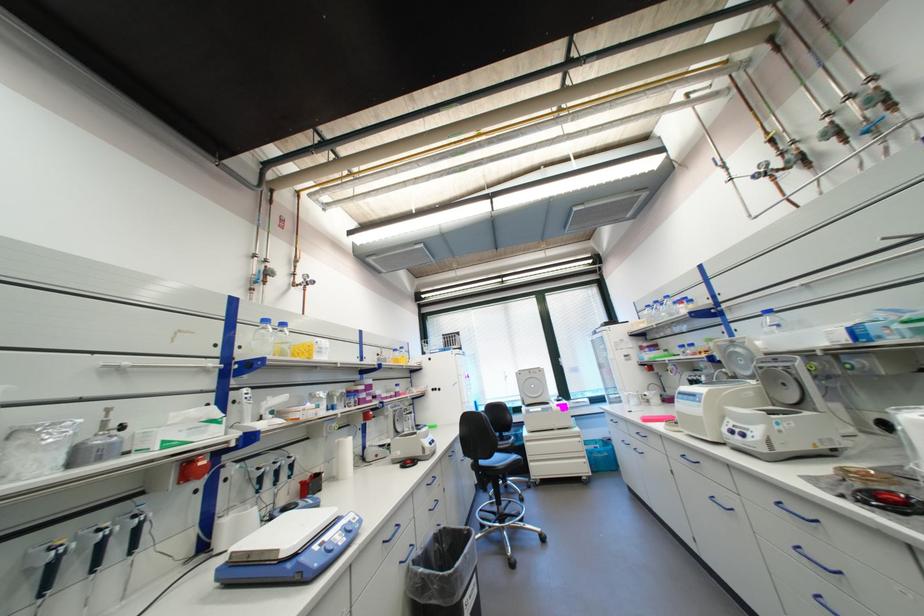
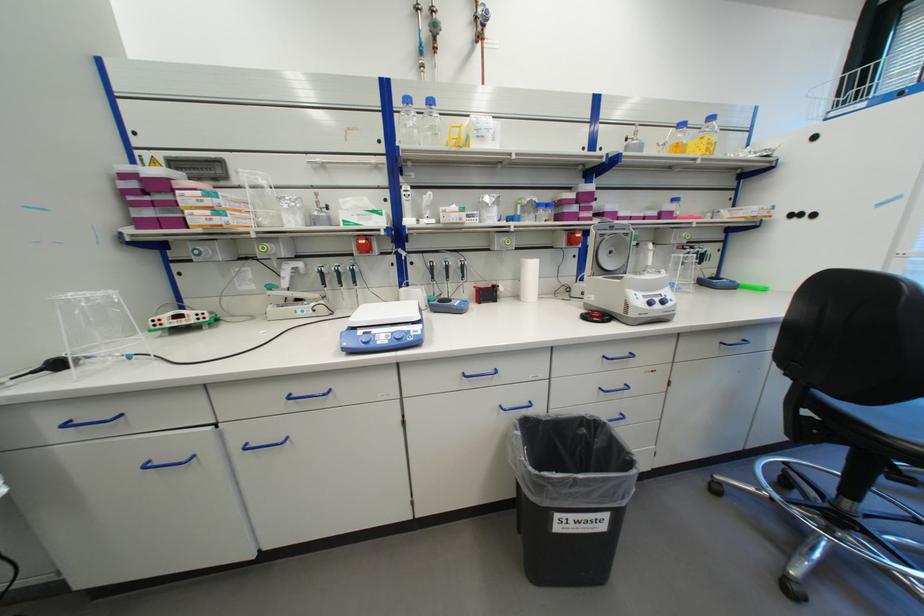
The point at [323,548] is marked in the first image. Where is the corresponding point in the second image?

(369, 333)